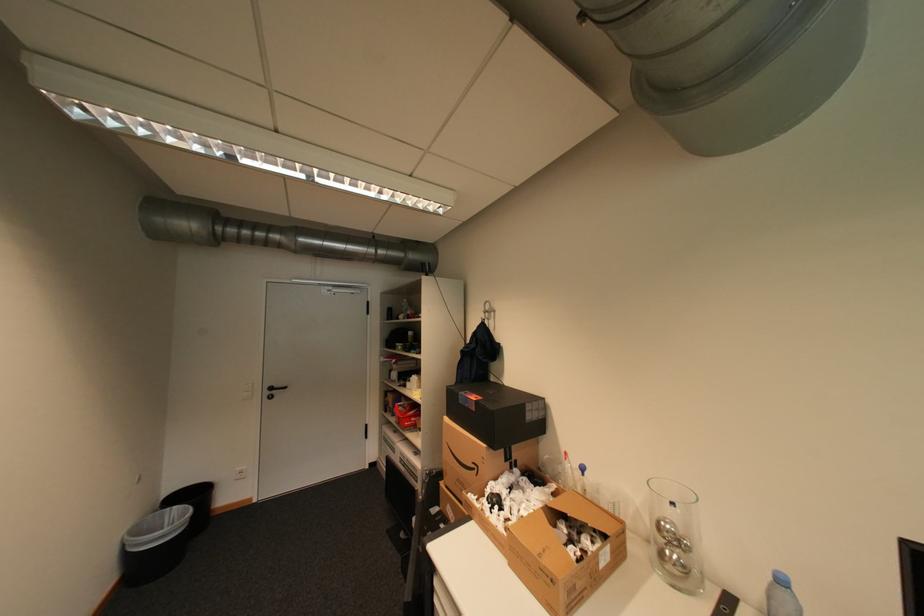
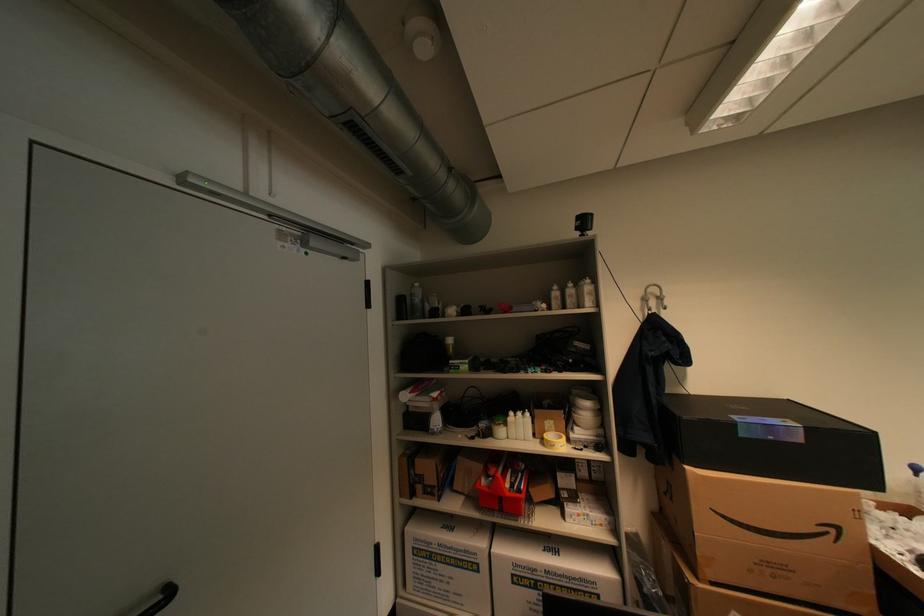
Find the pixel in the second image that matches (484,468) in the first image.

(841, 531)